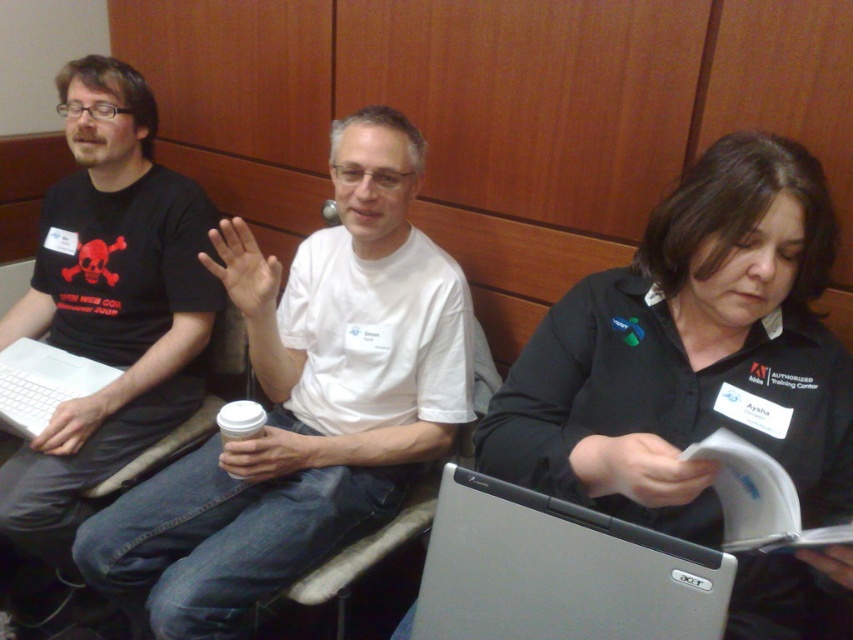
Is white matte t-shirt at center smaller than matte black t-shirt at left?

Indeed, white matte t-shirt at center has a smaller size compared to matte black t-shirt at left.

Who is more forward, (352,467) or (148,243)?

Positioned in front is point (352,467).

Image resolution: width=853 pixels, height=640 pixels. I want to click on white matte t-shirt at center, so point(305,404).

This screenshot has width=853, height=640. What do you see at coordinates (108, 307) in the screenshot? I see `matte black t-shirt at left` at bounding box center [108, 307].

Is matte black t-shirt at left further to the viewer compared to white matte laptop at left?

No, it is in front of white matte laptop at left.

Does point (223, 294) come closer to viewer compared to point (35, 390)?

That is False.

Where is `matte black t-shirt at left`? matte black t-shirt at left is located at coordinates (108, 307).

Image resolution: width=853 pixels, height=640 pixels. What do you see at coordinates (689, 353) in the screenshot?
I see `black fabric shirt at center` at bounding box center [689, 353].

Between black fabric shirt at center and silver metallic laptop at center, which one is positioned lower?

silver metallic laptop at center is lower down.

Describe the element at coordinates (689, 353) in the screenshot. This screenshot has height=640, width=853. I see `black fabric shirt at center` at that location.

Where is `black fabric shirt at center`? This screenshot has width=853, height=640. black fabric shirt at center is located at coordinates (689, 353).